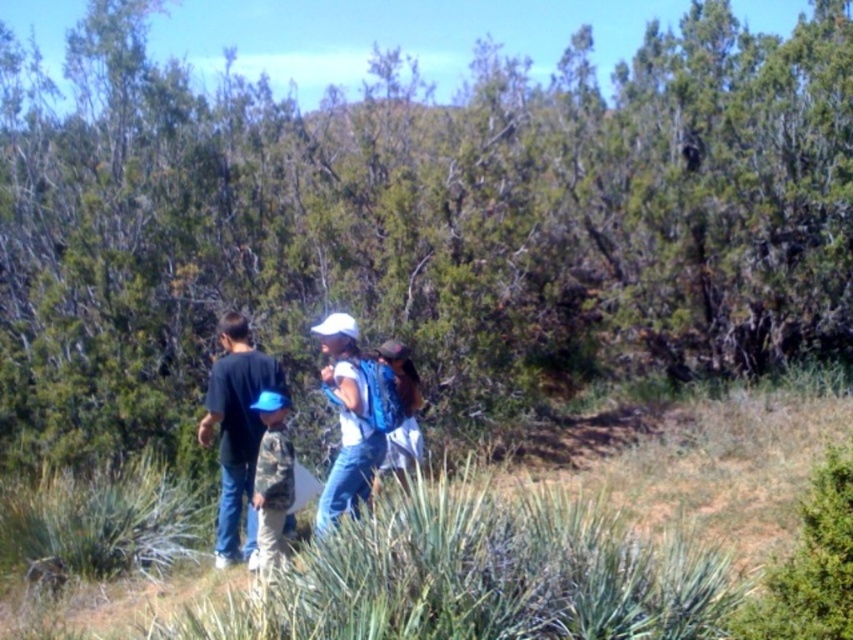
You are a hiker who needs to locate your white matte backpack at center. Based on the scene description, where would you look relative to the group of four individuals?

The white matte backpack at center is located at the 2D coordinates point (236, 422) in the scene, which places it centrally within the group of four individuals.

You are a photographer trying to capture a group photo of the white matte backpack at center and the black cotton shirt at left. To ensure both are in frame, should you adjust your camera to focus more to the left or the right?

The white matte backpack at center is to the right of the black cotton shirt at left, so you should focus more to the left to include both in the frame.